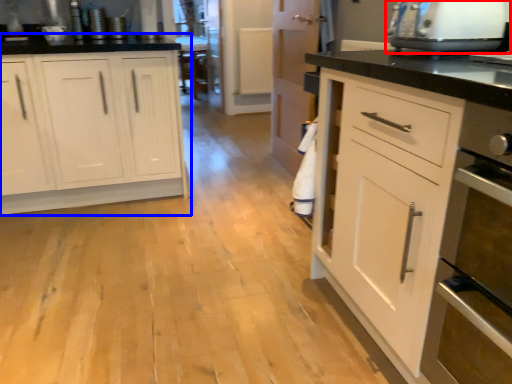
Question: Which point is closer to the camera, home appliance (highlighted by a red box) or cabinetry (highlighted by a blue box)?

Choices:
 (A) home appliance
 (B) cabinetry

Answer: (A)